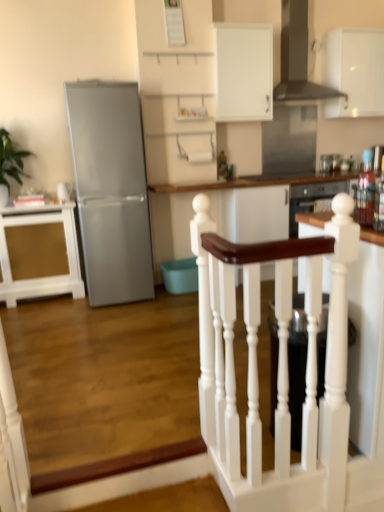
Question: Would you say satin silver refrigerator at left is to the left or to the right of green leafy plant at left in the picture?

Choices:
 (A) left
 (B) right

Answer: (B)

Question: Does point (145, 227) appear closer or farther from the camera than point (1, 158)?

Choices:
 (A) farther
 (B) closer

Answer: (A)

Question: Estimate the real-world distances between objects in this image. Which object is closer to the white painted wood handrail at center?

Choices:
 (A) white wood table at center
 (B) white matte cabinet at upper center, marked as the 2th cabinetry in a top-to-bottom arrangement
 (C) white matte cabinet at upper right, arranged as the third cabinetry when ordered from the bottom
 (D) satin silver refrigerator at left
 (E) metallic glass bottles at right, which is counted as the second appliance, starting from the top

Answer: (E)

Question: Estimate the real-world distances between objects in this image. Which object is farther from the stainless steel glass door at upper center?

Choices:
 (A) black matte exhaust hood at upper center
 (B) white matte cabinet at upper center, positioned as the 2th cabinetry in left-to-right order
 (C) satin silver refrigerator at left
 (D) white matte cabinet at upper right, which ranks as the 3th cabinetry in left-to-right order
 (E) white wood table at center

Answer: (C)